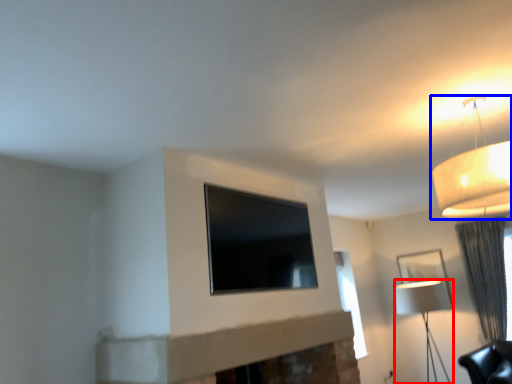
Question: Which object appears closest to the camera in this image, lamp (highlighted by a red box) or lamp (highlighted by a blue box)?

Choices:
 (A) lamp
 (B) lamp

Answer: (B)